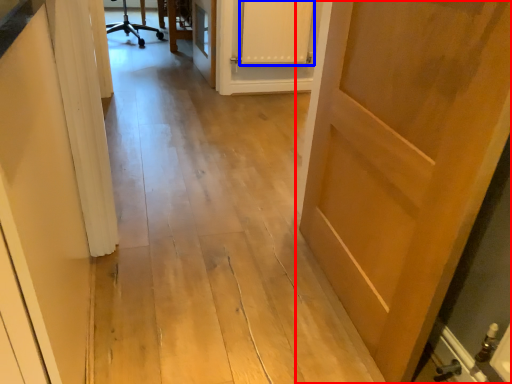
Question: Which object appears closest to the camera in this image, door (highlighted by a red box) or cabinetry (highlighted by a blue box)?

Choices:
 (A) door
 (B) cabinetry

Answer: (A)